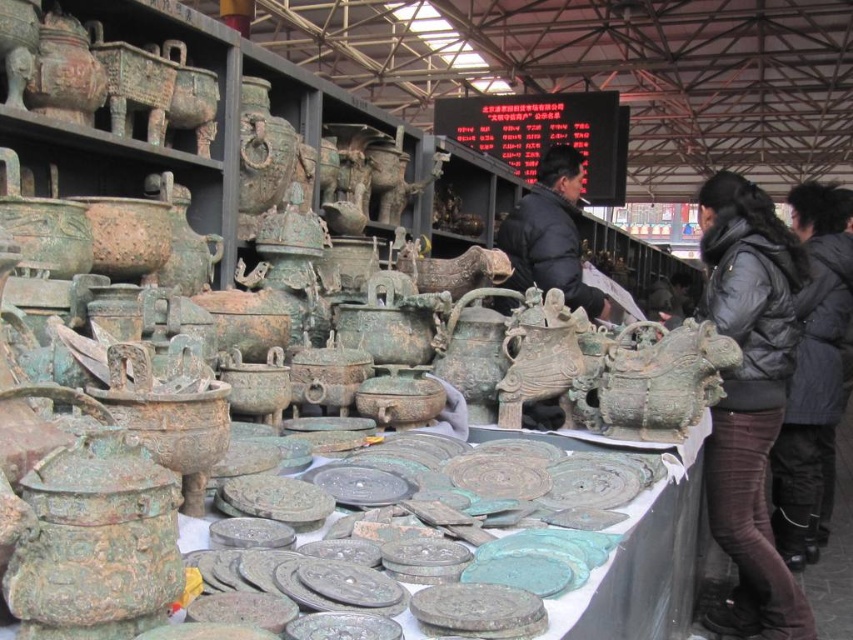
Question: Which is nearer to the black puffy jacket at right?

Choices:
 (A) dark gray puffy jacket at right
 (B) black matte jacket at center

Answer: (A)

Question: Which point is closer to the camera taking this photo?

Choices:
 (A) (808, 500)
 (B) (786, 387)

Answer: (B)

Question: Is dark gray puffy jacket at right bigger than black puffy jacket at right?

Choices:
 (A) yes
 (B) no

Answer: (B)

Question: Which object appears closest to the camera in this image?

Choices:
 (A) black matte jacket at center
 (B) dark gray puffy jacket at right

Answer: (B)

Question: Can you confirm if dark gray puffy jacket at right is positioned above black matte jacket at center?

Choices:
 (A) no
 (B) yes

Answer: (A)

Question: Is dark gray puffy jacket at right smaller than black matte jacket at center?

Choices:
 (A) yes
 (B) no

Answer: (B)